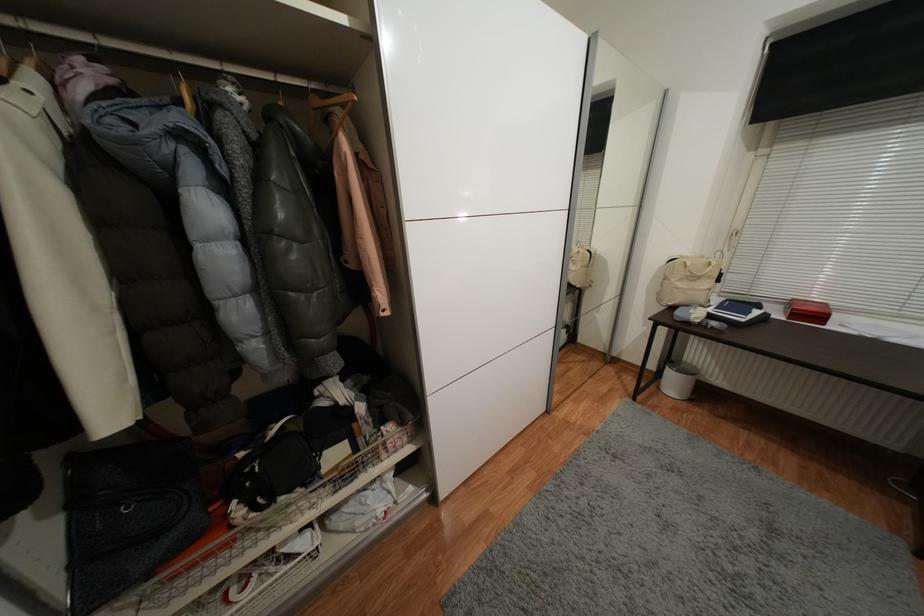
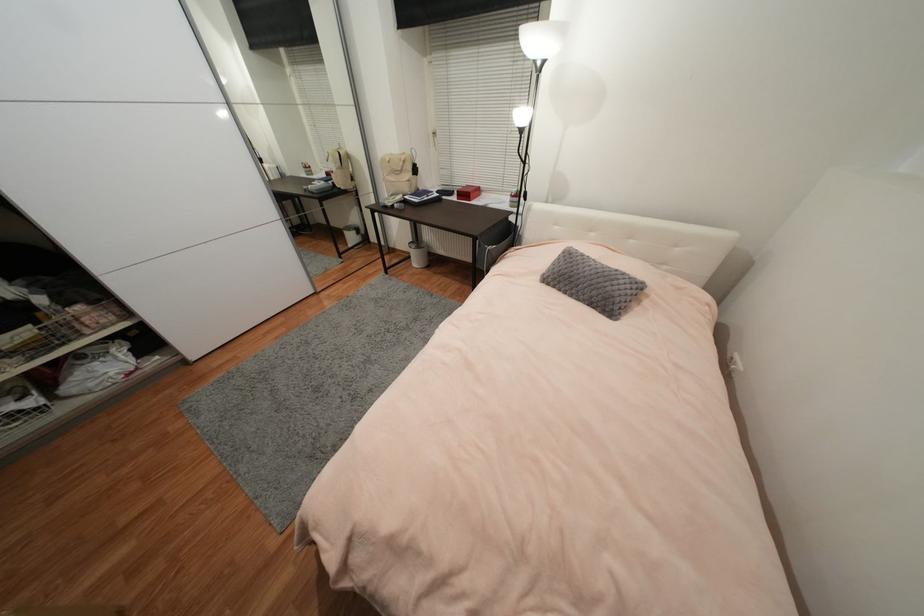
Find the pixel in the second image that matches the point at 707,302 in the first image.

(410, 191)